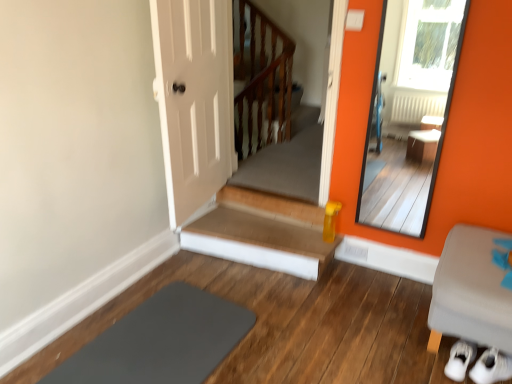
This screenshot has height=384, width=512. I want to click on blank space situated above slate at lower left (from a real-world perspective), so click(x=159, y=344).